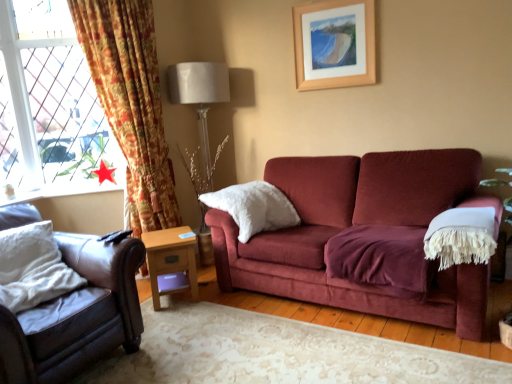
What do you see at coordinates (104, 173) in the screenshot?
I see `red fabric star at lower left` at bounding box center [104, 173].

The image size is (512, 384). What are the coordinates of `clear glass window at left` in the screenshot? It's located at (50, 107).

The image size is (512, 384). In order to click on wooden picture frame at upper center in this screenshot , I will do `click(356, 45)`.

What do you see at coordinates (356, 45) in the screenshot? I see `wooden picture frame at upper center` at bounding box center [356, 45].

I want to click on leather couch at left, so click(77, 315).

Image resolution: width=512 pixels, height=384 pixels. In order to click on white fabric at upper center in this screenshot , I will do `click(199, 109)`.

From the image's perspective, does light brown wooden side table at lower center appear lower than wooden picture frame at upper center?

Yes.

From the picture: Is wooden picture frame at upper center completely or partially inside light brown wooden side table at lower center?

No, light brown wooden side table at lower center does not contain wooden picture frame at upper center.

From a real-world perspective, is light brown wooden side table at lower center under wooden picture frame at upper center?

Correct, in the physical world, light brown wooden side table at lower center is lower than wooden picture frame at upper center.

Relative to wooden picture frame at upper center, is light brown wooden side table at lower center in front or behind?

In the image, light brown wooden side table at lower center appears in front of wooden picture frame at upper center.

From the image's perspective, would you say wooden picture frame at upper center is positioned over leather couch at left?

Yes, from the image's perspective, wooden picture frame at upper center is over leather couch at left.

Is wooden picture frame at upper center oriented towards leather couch at left?

No, wooden picture frame at upper center is not aimed at leather couch at left.

Are light brown wooden side table at lower center and red fabric star at lower left making contact?

light brown wooden side table at lower center and red fabric star at lower left are not in contact.

How far apart are light brown wooden side table at lower center and red fabric star at lower left?

light brown wooden side table at lower center and red fabric star at lower left are 88.59 centimeters apart from each other.

Is light brown wooden side table at lower center aimed at red fabric star at lower left?

No, light brown wooden side table at lower center does not turn towards red fabric star at lower left.

Is light brown wooden side table at lower center at the right side of red fabric star at lower left?

Indeed, light brown wooden side table at lower center is positioned on the right side of red fabric star at lower left.

From the image's perspective, which one is positioned higher, light brown wooden side table at lower center or floral fabric curtain at left?

floral fabric curtain at left is shown above in the image.

Considering the relative sizes of light brown wooden side table at lower center and floral fabric curtain at left in the image provided, is light brown wooden side table at lower center shorter than floral fabric curtain at left?

Yes, light brown wooden side table at lower center is shorter than floral fabric curtain at left.

Would you say floral fabric curtain at left is part of light brown wooden side table at lower center's contents?

No, floral fabric curtain at left is not a part of light brown wooden side table at lower center.

Can we say white soft pillow at left, the 2th pillow when ordered from back to front, lies outside light brown wooden side table at lower center?

Yes, white soft pillow at left, the 2th pillow when ordered from back to front, is located beyond the bounds of light brown wooden side table at lower center.

Is white soft pillow at left, the 2th pillow when ordered from back to front, beside light brown wooden side table at lower center?

No, white soft pillow at left, the 2th pillow when ordered from back to front, is not beside light brown wooden side table at lower center.

Is white soft pillow at left, the 2th pillow when ordered from back to front, looking in the opposite direction of light brown wooden side table at lower center?

That's not correct — white soft pillow at left, the 2th pillow when ordered from back to front, is not looking away from light brown wooden side table at lower center.

Measure the distance from white soft pillow at left, placed as the first pillow when sorted from front to back, to light brown wooden side table at lower center.

A distance of 29.39 inches exists between white soft pillow at left, placed as the first pillow when sorted from front to back, and light brown wooden side table at lower center.

Considering the sizes of floral fabric curtain at left and leather couch at left in the image, is floral fabric curtain at left taller or shorter than leather couch at left?

In the image, floral fabric curtain at left appears to be taller than leather couch at left.

Is floral fabric curtain at left located outside leather couch at left?

floral fabric curtain at left lies outside leather couch at left's area.

Could you tell me if floral fabric curtain at left is turned towards leather couch at left?

No, floral fabric curtain at left is not facing towards leather couch at left.

Is floral fabric curtain at left next to leather couch at left and touching it?

There is a gap between floral fabric curtain at left and leather couch at left.

Between point (149, 240) and point (42, 75), which one is positioned behind?

The point (42, 75) is farther from the camera.

Could you tell me if light brown wooden side table at lower center is turned towards clear glass window at left?

No.

Is light brown wooden side table at lower center wider than clear glass window at left?

Yes, light brown wooden side table at lower center is wider than clear glass window at left.

Is light brown wooden side table at lower center situated inside clear glass window at left or outside?

light brown wooden side table at lower center is located beyond the bounds of clear glass window at left.

Locate an element on the screen. The width and height of the screenshot is (512, 384). table directly beneath the wooden picture frame at upper center (from a real-world perspective) is located at coordinates (170, 258).

You are a GUI agent. You are given a task and a screenshot of the screen. Output one action in this format:
    pyautogui.click(x=<x>, y=<y>)
    Task: Click on the studio couch on the left of wooden picture frame at upper center
    The image size is (512, 384).
    Given the screenshot: What is the action you would take?
    pyautogui.click(x=77, y=315)

Estimate the real-world distances between objects in this image. Which object is closer to floral fabric curtain at left, red fabric star at lower left or leather couch at left?

red fabric star at lower left lies closer to floral fabric curtain at left than the other object.

Which object lies further to the anchor point wooden picture frame at upper center, light brown wooden side table at lower center or white fabric at upper center?

light brown wooden side table at lower center is further to wooden picture frame at upper center.

From the image, which object appears to be nearer to white fabric at upper center, white fluffy pillow at center, the 1th pillow in the right-to-left sequence, or white soft pillow at left, which appears as the first pillow when viewed from the left?

The object closer to white fabric at upper center is white fluffy pillow at center, the 1th pillow in the right-to-left sequence.

In the scene shown: Based on their spatial positions, is wooden picture frame at upper center or red fabric star at lower left further from white fluffy pillow at center, arranged as the first pillow when viewed from the back?

red fabric star at lower left lies further to white fluffy pillow at center, arranged as the first pillow when viewed from the back, than the other object.

From the image, which object appears to be farther from white fluffy pillow at center, arranged as the first pillow when viewed from the back, white fabric at upper center or white soft pillow at left, the 2th pillow from the right?

white soft pillow at left, the 2th pillow from the right.

When comparing their distances from light brown wooden side table at lower center, does white fabric at upper center or red fabric star at lower left seem closer?

white fabric at upper center.

Estimate the real-world distances between objects in this image. Which object is further from white soft pillow at left, placed as the first pillow when sorted from front to back, red fabric star at lower left or white fluffy pillow at center, the 1th pillow in the right-to-left sequence?

Among the two, white fluffy pillow at center, the 1th pillow in the right-to-left sequence, is located further to white soft pillow at left, placed as the first pillow when sorted from front to back.

Considering their positions, is white soft pillow at left, which appears as the first pillow when viewed from the left, positioned further to leather couch at left than floral fabric curtain at left?

floral fabric curtain at left is further to leather couch at left.

I want to click on curtain located between leather couch at left and light brown wooden side table at lower center in the depth direction, so click(131, 102).

I want to click on table lamp between wooden picture frame at upper center and white fluffy pillow at center, which appears as the 2th pillow when viewed from the left, from top to bottom, so click(199, 109).

Image resolution: width=512 pixels, height=384 pixels. Identify the location of window between white soft pillow at left, which appears as the first pillow when viewed from the left, and red fabric star at lower left in the front-back direction. (50, 107).

The width and height of the screenshot is (512, 384). In order to click on star that lies between floral fabric curtain at left and light brown wooden side table at lower center from top to bottom in this screenshot , I will do `click(104, 173)`.